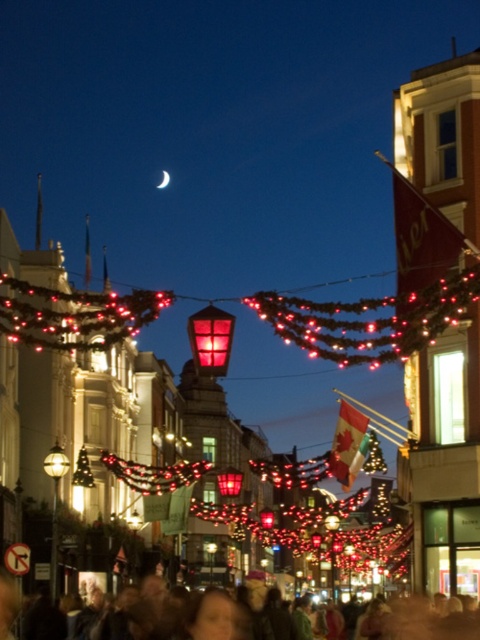
Describe the element at coordinates (370, 321) in the screenshot. This screenshot has height=640, width=480. I see `matte glass lantern at center` at that location.

Based on the photo, who is positioned more to the left, matte glass lantern at center or matte red lantern at center?

matte glass lantern at center is more to the left.

Is point (456, 314) less distant than point (194, 324)?

Yes, point (456, 314) is closer to viewer.

Find the location of a particular element. Image resolution: width=480 pixels, height=640 pixels. matte glass lantern at center is located at coordinates (370, 321).

Does matte red lantern at center have a lesser width compared to silver metallic crescent moon at upper center?

Correct, matte red lantern at center's width is less than silver metallic crescent moon at upper center's.

Does matte red lantern at center appear over silver metallic crescent moon at upper center?

Actually, matte red lantern at center is below silver metallic crescent moon at upper center.

Image resolution: width=480 pixels, height=640 pixels. I want to click on matte red lantern at center, so click(211, 339).

Locate an element on the screen. The image size is (480, 640). matte red lantern at center is located at coordinates (211, 339).

Is matte black crowd at center positioned before matte red lantern at center?

No.

Is point (12, 618) positioned behind point (215, 339)?

Yes, point (12, 618) is farther from viewer.

Locate an element on the screen. matte black crowd at center is located at coordinates (429, 621).